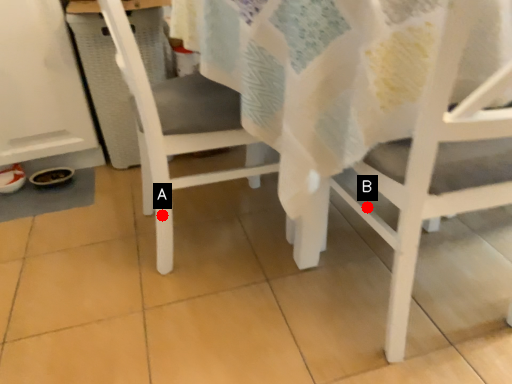
Question: Two points are circled on the image, labeled by A and B beside each circle. Which point is closer to the camera?

Choices:
 (A) A is closer
 (B) B is closer

Answer: (B)